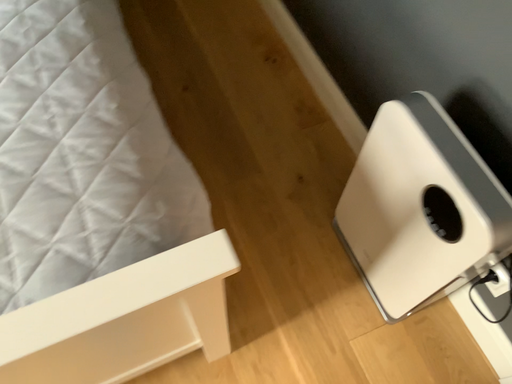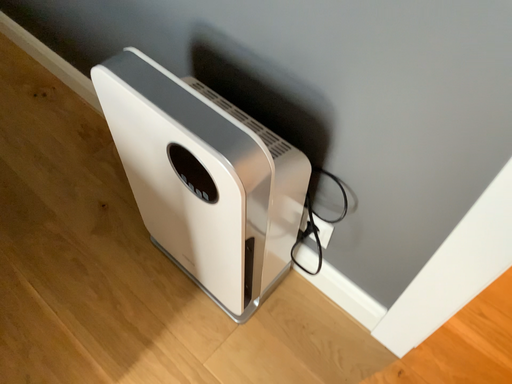
Question: How did the camera likely rotate when shooting the video?

Choices:
 (A) rotated left
 (B) rotated right

Answer: (B)